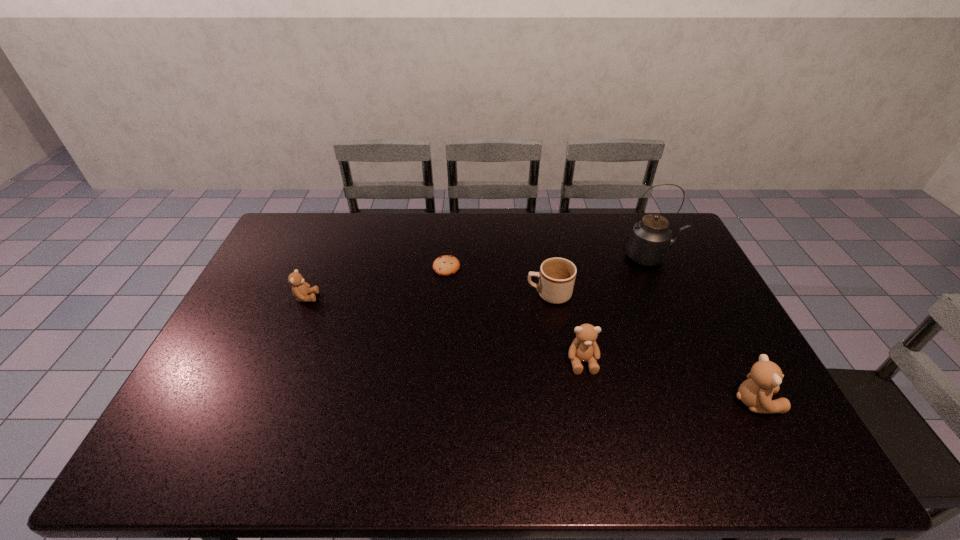
I want to click on the leftmost teddy bear, so tap(300, 289).

The image size is (960, 540). Find the location of `the leftmost object`. the leftmost object is located at coordinates (300, 289).

Identify the location of the second tallest teddy bear. This screenshot has width=960, height=540. click(584, 348).

You are a GUI agent. You are given a task and a screenshot of the screen. Output one action in this format:
    pyautogui.click(x=<x>, y=<y>)
    Task: Click on the second teddy bear from right to left
    
    Given the screenshot: What is the action you would take?
    pyautogui.click(x=584, y=348)

Find the location of a particular element. The image size is (960, 540). the rightmost teddy bear is located at coordinates (763, 381).

Where is `the nearest teddy bear`? the nearest teddy bear is located at coordinates tap(763, 381).

Locate an element on the screen. This screenshot has width=960, height=540. mug is located at coordinates (557, 275).

Image resolution: width=960 pixels, height=540 pixels. Identify the location of kettle. (650, 239).

Where is `the second object from left to right`? the second object from left to right is located at coordinates (446, 265).

What are the coordinates of `the shortest object` in the screenshot? It's located at (446, 265).